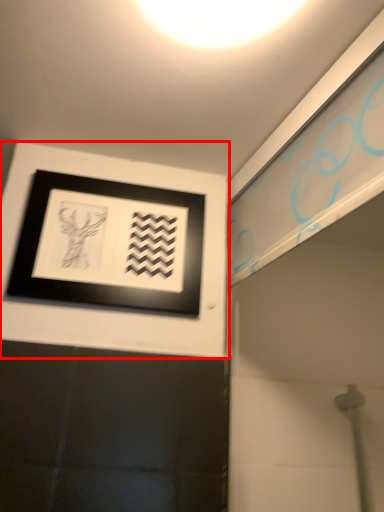
Question: From the image's perspective, what is the correct spatial relationship of picture frame (annotated by the red box) in relation to light?

Choices:
 (A) below
 (B) above

Answer: (A)